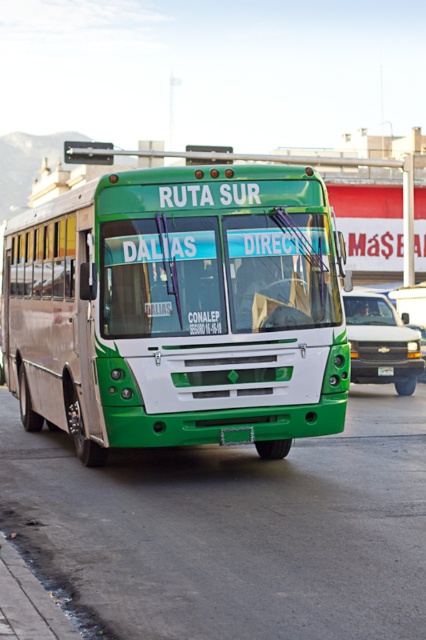
Is green matte bus at center below matte white truck at center?

No.

From the picture: Who is more forward, (333,381) or (356,346)?

Point (333,381) is more forward.

Locate an element on the screen. green matte bus at center is located at coordinates (178, 310).

Does matte white truck at center appear under green matte license plate at center?

Incorrect, matte white truck at center is not positioned below green matte license plate at center.

Is point (409, 376) less distant than point (379, 368)?

That is False.

Find the location of a particular element. Image resolution: width=426 pixels, height=640 pixels. matte white truck at center is located at coordinates (380, 340).

Does green matte bus at center appear over green matte license plate at center?

Indeed, green matte bus at center is positioned over green matte license plate at center.

Where is `green matte bus at center`? green matte bus at center is located at coordinates (178, 310).

The image size is (426, 640). Identify the location of green matte bus at center. (178, 310).